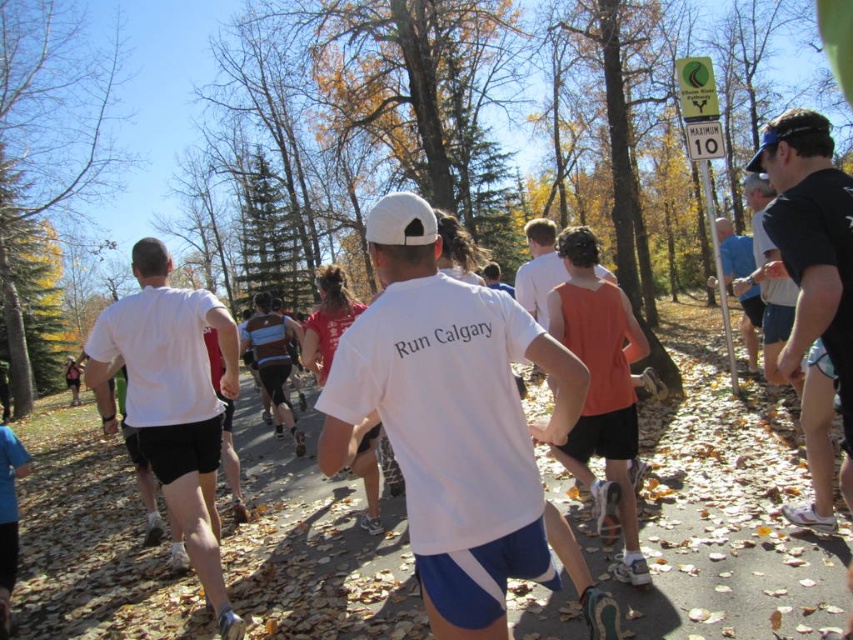
Question: From the image, what is the correct spatial relationship of orange fabric tank top at center in relation to orange cotton tank top at center?

Choices:
 (A) above
 (B) below

Answer: (B)

Question: Estimate the real-world distances between objects in this image. Which object is closer to the white matte t-shirt at center?

Choices:
 (A) black mesh shorts at right
 (B) blue fabric shirt at right

Answer: (A)

Question: Which point appears closest to the camera in this image?

Choices:
 (A) (573, 284)
 (B) (532, 291)

Answer: (A)

Question: Is the position of orange cotton tank top at center less distant than that of blue fabric shirt at right?

Choices:
 (A) no
 (B) yes

Answer: (B)

Question: Which object is closer to the camera taking this photo?

Choices:
 (A) white matte shorts at center
 (B) blue fabric shirt at right
 (C) white matte t-shirt at center
 (D) orange fabric tank top at center

Answer: (C)

Question: Is black mesh shorts at right thinner than orange cotton tank top at center?

Choices:
 (A) no
 (B) yes

Answer: (B)